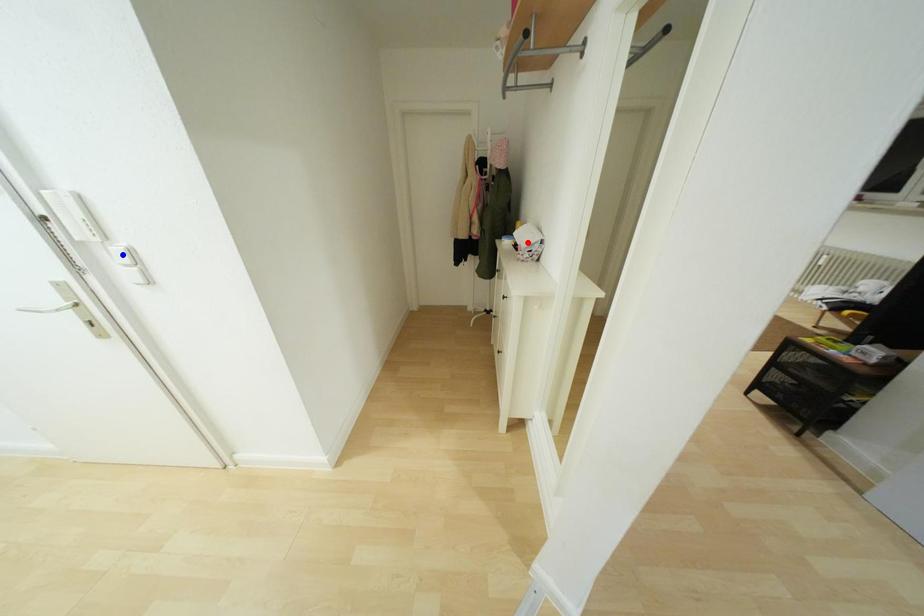
Question: Which of the two points in the image is closer to the camera?

Choices:
 (A) Blue point is closer.
 (B) Red point is closer.

Answer: (A)